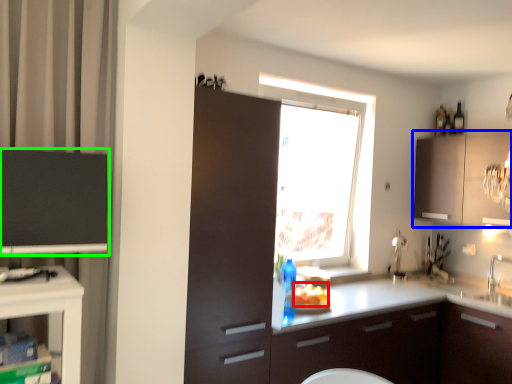
Question: Which object is the closest to the food (highlighted by a red box)? Choose among these: cabinetry (highlighted by a blue box) or cabinetry (highlighted by a green box).

Choices:
 (A) cabinetry
 (B) cabinetry

Answer: (A)